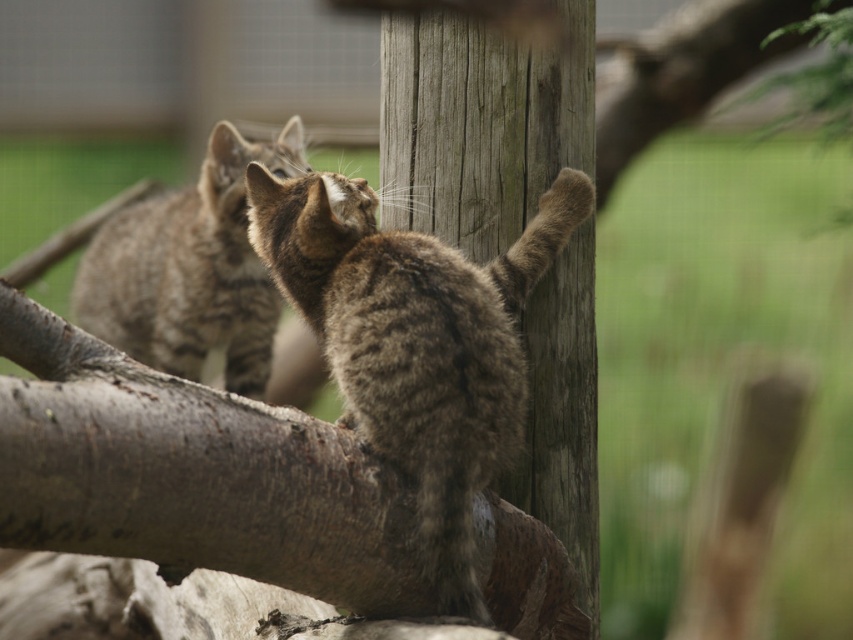
Is brown fur cat at center above tabby fur cat at upper left?

Actually, brown fur cat at center is below tabby fur cat at upper left.

Can you confirm if brown fur cat at center is shorter than tabby fur cat at upper left?

Indeed, brown fur cat at center has a lesser height compared to tabby fur cat at upper left.

Does point (283, 228) come in front of point (212, 202)?

That is True.

Locate an element on the screen. This screenshot has width=853, height=640. brown fur cat at center is located at coordinates click(x=415, y=340).